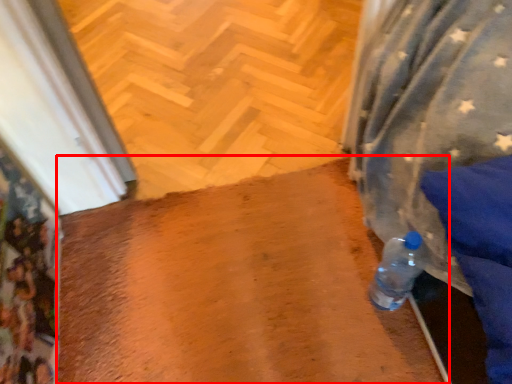
Question: Where is wide (annotated by the red box) located in relation to path in the image?

Choices:
 (A) right
 (B) left

Answer: (A)